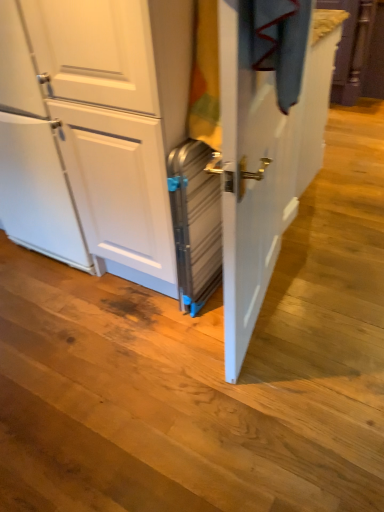
Question: From a real-world perspective, is metallic silver suitcase at center over metallic silver screen door at center?

Choices:
 (A) yes
 (B) no

Answer: (B)

Question: Could you tell me if metallic silver suitcase at center is turned towards metallic silver screen door at center?

Choices:
 (A) no
 (B) yes

Answer: (A)

Question: Is metallic silver suitcase at center at the right side of metallic silver screen door at center?

Choices:
 (A) yes
 (B) no

Answer: (B)

Question: Is metallic silver suitcase at center positioned in front of metallic silver screen door at center?

Choices:
 (A) yes
 (B) no

Answer: (B)

Question: Is metallic silver suitcase at center not inside metallic silver screen door at center?

Choices:
 (A) yes
 (B) no

Answer: (A)

Question: From a real-world perspective, is metallic silver suitcase at center physically below metallic silver screen door at center?

Choices:
 (A) no
 (B) yes

Answer: (B)

Question: From the image's perspective, is metallic silver screen door at center on top of metallic silver suitcase at center?

Choices:
 (A) no
 (B) yes

Answer: (B)

Question: Is metallic silver screen door at center positioned beyond the bounds of metallic silver suitcase at center?

Choices:
 (A) yes
 (B) no

Answer: (A)

Question: Is metallic silver screen door at center taller than metallic silver suitcase at center?

Choices:
 (A) yes
 (B) no

Answer: (A)

Question: From the image's perspective, is metallic silver screen door at center located beneath metallic silver suitcase at center?

Choices:
 (A) yes
 (B) no

Answer: (B)

Question: Is metallic silver screen door at center positioned with its back to metallic silver suitcase at center?

Choices:
 (A) no
 (B) yes

Answer: (B)

Question: Considering the relative sizes of metallic silver screen door at center and metallic silver suitcase at center in the image provided, is metallic silver screen door at center bigger than metallic silver suitcase at center?

Choices:
 (A) yes
 (B) no

Answer: (A)

Question: Is point (225, 240) positioned closer to the camera than point (173, 154)?

Choices:
 (A) farther
 (B) closer

Answer: (B)